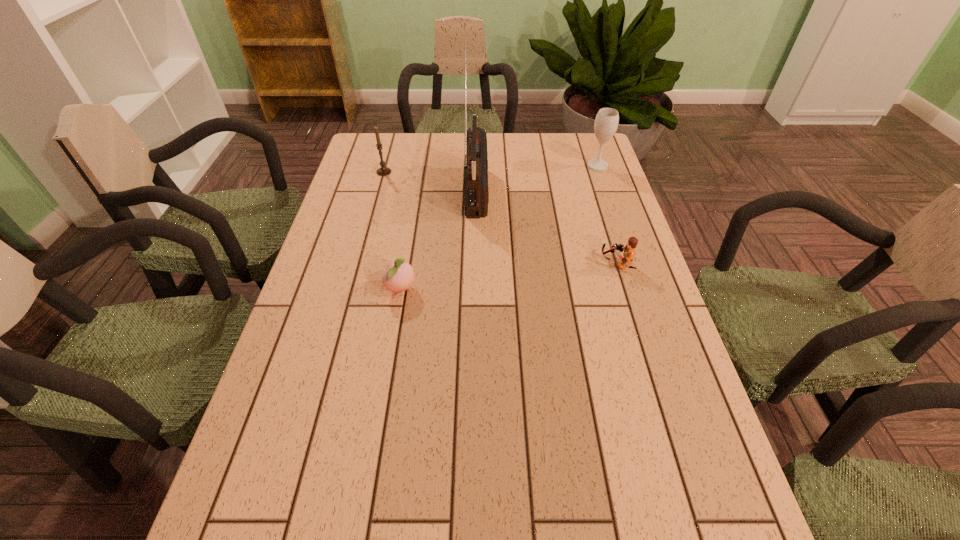
Locate an element on the screen. The width and height of the screenshot is (960, 540). free space located 0.120m on the back of the leftmost object is located at coordinates (390, 149).

Image resolution: width=960 pixels, height=540 pixels. I want to click on blank area located 0.210m holding a crossbow in the hands of the Lego, so click(x=519, y=264).

Identify the location of free space located 0.130m holding a crossbow in the hands of the Lego. (551, 264).

At what (x,y) coordinates should I click in order to perform the action: click on blank space located 0.310m holding a crossbow in the hands of the Lego. Please return your answer as a coordinate pair (x, y). The width and height of the screenshot is (960, 540). Looking at the image, I should click on (481, 264).

This screenshot has height=540, width=960. I want to click on vacant region located 0.170m on the front of the fourth object from right to left, so click(389, 361).

Locate an element on the screen. This screenshot has height=540, width=960. radio receiver that is at the far edge is located at coordinates (476, 194).

Find the location of a particular element. Image resolution: width=960 pixels, height=540 pixels. wineglass at the far edge is located at coordinates (606, 122).

I want to click on candle at the far edge, so click(x=383, y=171).

At what (x,y) coordinates should I click in order to perform the action: click on object that is at the left edge. Please return your answer as a coordinate pair (x, y). The width and height of the screenshot is (960, 540). Looking at the image, I should click on (383, 171).

The image size is (960, 540). Find the location of `wineglass present at the right edge`. wineglass present at the right edge is located at coordinates (606, 122).